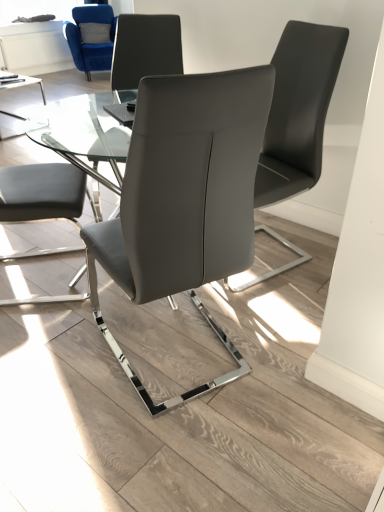
Identify the location of vacant space that is in between matte gray chair at center, arranged as the 2th chair when viewed from the right, and transparent glass table at center. (194, 319).